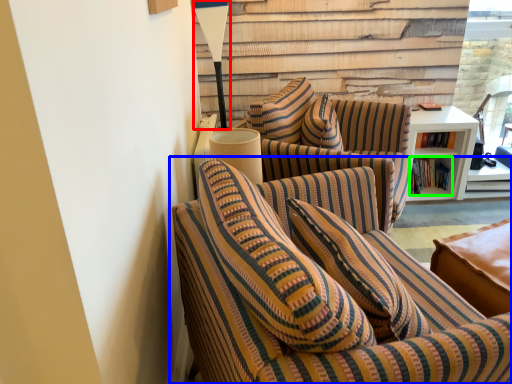
Question: Which is nearer to the table lamp (highlighted by a red box)? studio couch (highlighted by a blue box) or book (highlighted by a green box).

Choices:
 (A) studio couch
 (B) book

Answer: (B)